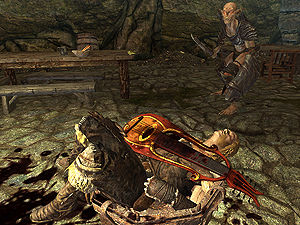
This screenshot has width=300, height=225. I want to click on dark room, so click(175, 65).